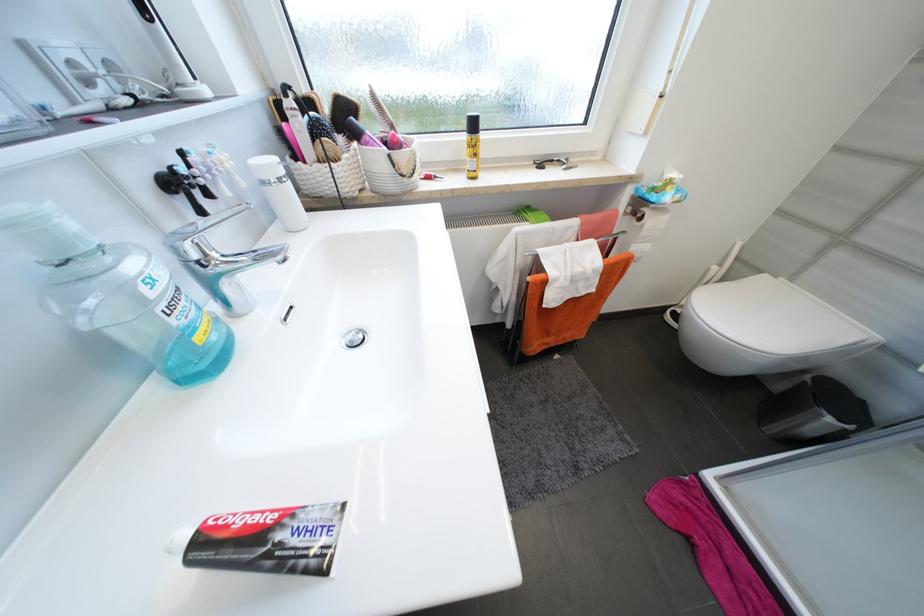
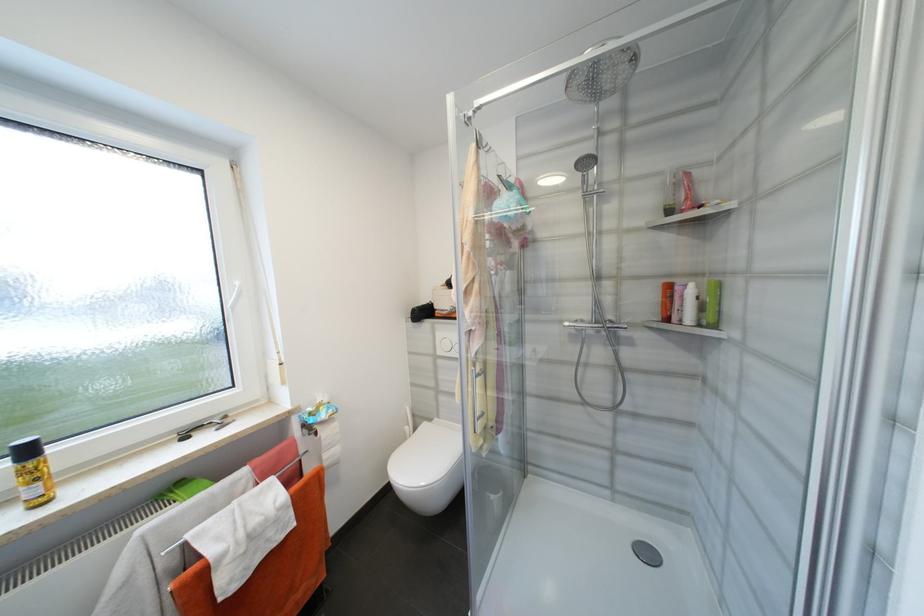
Locate, in the second image, the point that corresponds to point 480,127 in the first image.

(33, 453)